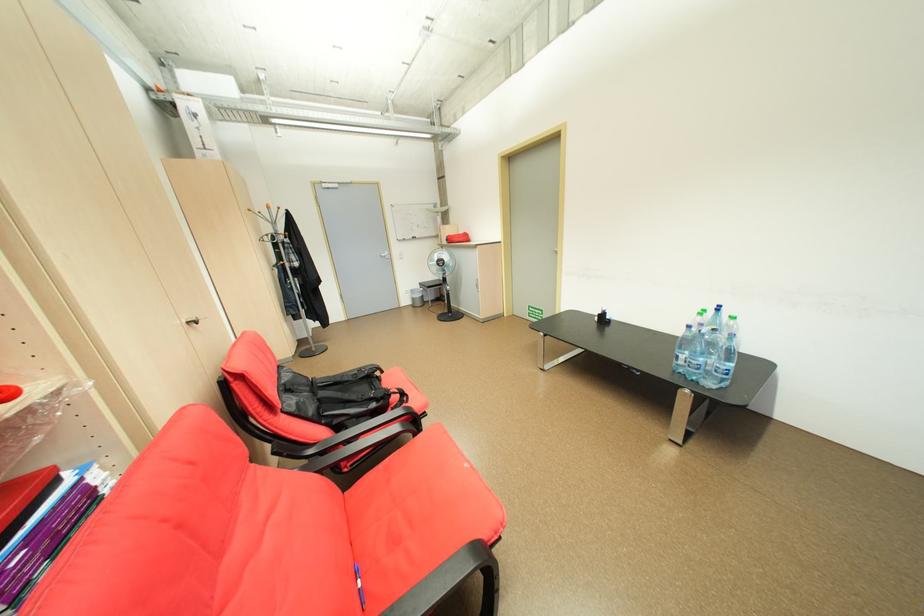
Find where to pull the light grey door handle. Please return your answer as a coordinate pair (x, y).

(553, 249)